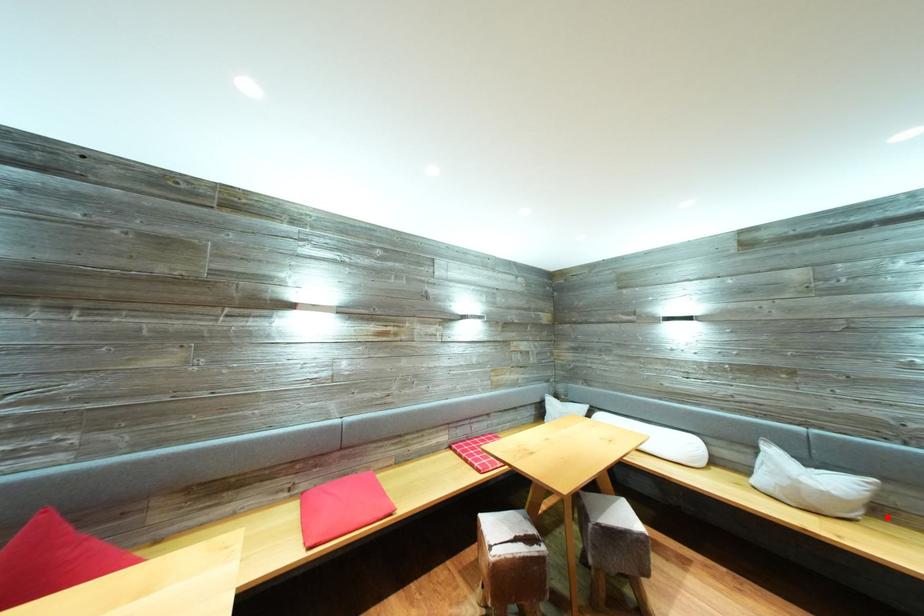
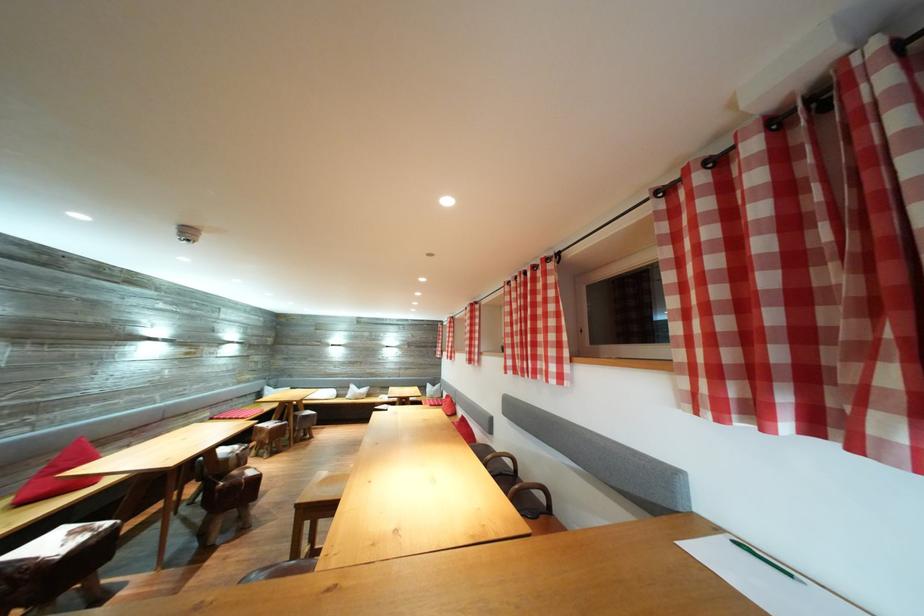
The point at the highlighted location is marked in the first image. Where is the corresponding point in the second image?

(375, 400)